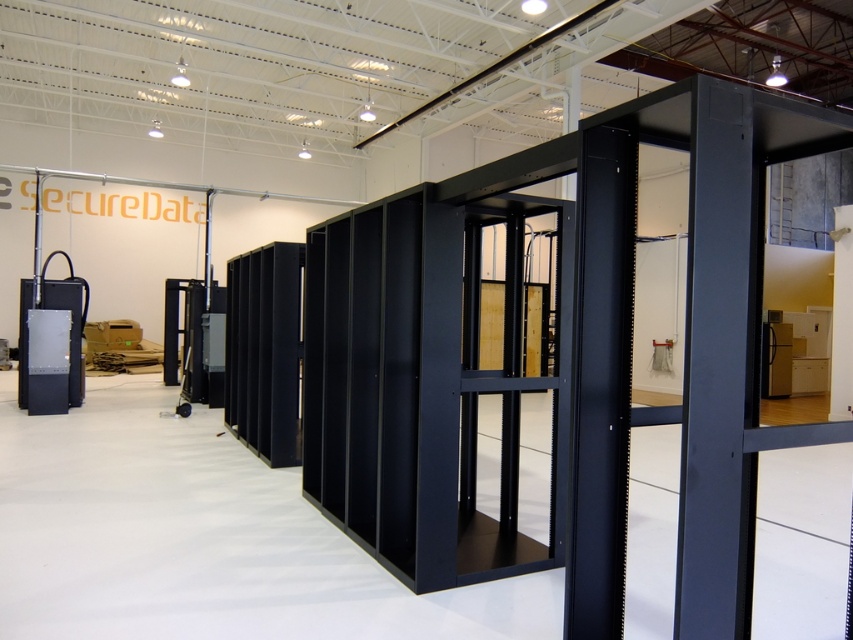
Question: Does transparent glass door at center appear on the left side of black metallic sensor at left?

Choices:
 (A) yes
 (B) no

Answer: (B)

Question: Is transparent glass door at center to the right of black metallic sensor at left from the viewer's perspective?

Choices:
 (A) yes
 (B) no

Answer: (A)

Question: Among these objects, which one is farthest from the camera?

Choices:
 (A) transparent glass door at center
 (B) black metallic sensor at left

Answer: (B)

Question: Which point is farther to the camera?

Choices:
 (A) transparent glass door at center
 (B) black metallic sensor at left

Answer: (B)

Question: Does transparent glass door at center have a lesser width compared to black metallic sensor at left?

Choices:
 (A) yes
 (B) no

Answer: (B)

Question: Among these objects, which one is nearest to the camera?

Choices:
 (A) black metallic sensor at left
 (B) transparent glass door at center

Answer: (B)